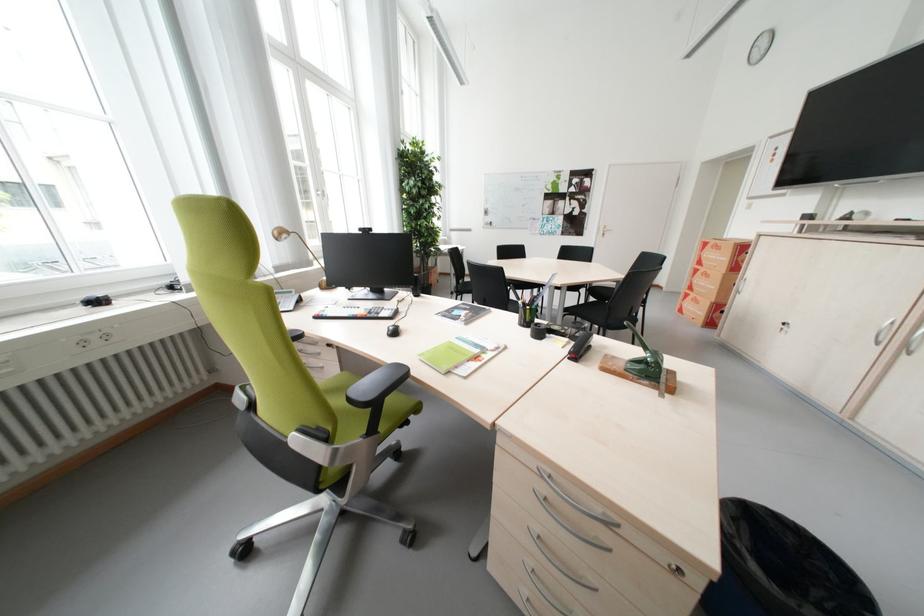
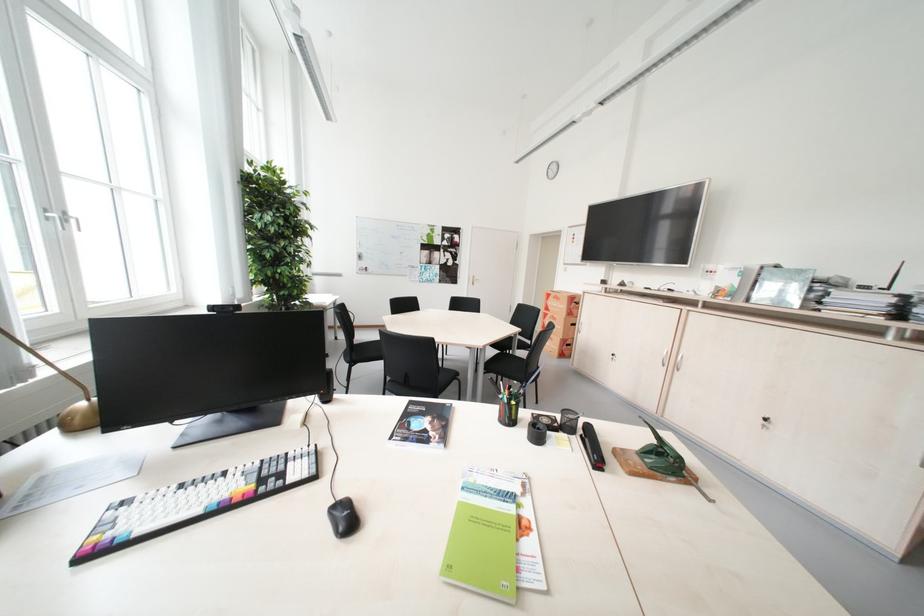
Find the pixel in the second image that matches [602,225] in the first image.

(473, 275)